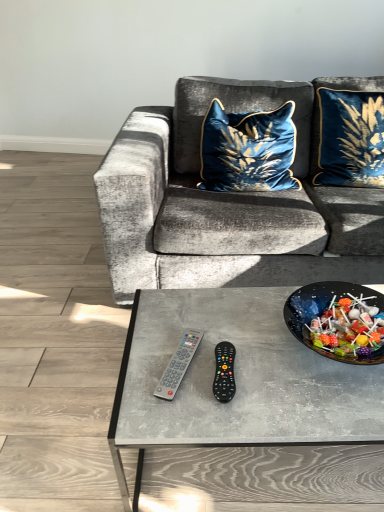
Question: Is velvet blue cushion at center, which is counted as the 1th pillow, starting from the left, smaller than gray plastic remote at center?

Choices:
 (A) yes
 (B) no

Answer: (B)

Question: Does velvet blue cushion at center, placed as the second pillow when sorted from right to left, appear on the right side of gray plastic remote at center?

Choices:
 (A) no
 (B) yes

Answer: (B)

Question: Does velvet blue cushion at center, which is counted as the 1th pillow, starting from the left, lie behind gray plastic remote at center?

Choices:
 (A) no
 (B) yes

Answer: (B)

Question: Does velvet blue cushion at center, which is counted as the 1th pillow, starting from the left, have a greater width compared to gray plastic remote at center?

Choices:
 (A) yes
 (B) no

Answer: (A)

Question: Can you confirm if velvet blue cushion at center, placed as the second pillow when sorted from right to left, is shorter than gray plastic remote at center?

Choices:
 (A) no
 (B) yes

Answer: (A)

Question: Is velvet blue cushion at center, placed as the second pillow when sorted from right to left, positioned beyond the bounds of gray plastic remote at center?

Choices:
 (A) yes
 (B) no

Answer: (A)

Question: Does black plastic remote at center have a greater height compared to velvet blue pillow at upper right, positioned as the second pillow in left-to-right order?

Choices:
 (A) no
 (B) yes

Answer: (A)

Question: Does black plastic remote at center contain velvet blue pillow at upper right, positioned as the second pillow in left-to-right order?

Choices:
 (A) no
 (B) yes

Answer: (A)

Question: Is black plastic remote at center at the left side of velvet blue pillow at upper right, marked as the 1th pillow in a right-to-left arrangement?

Choices:
 (A) yes
 (B) no

Answer: (A)

Question: Is black plastic remote at center to the right of velvet blue pillow at upper right, marked as the 1th pillow in a right-to-left arrangement, from the viewer's perspective?

Choices:
 (A) yes
 (B) no

Answer: (B)

Question: Is black plastic remote at center closer to the viewer compared to velvet blue pillow at upper right, marked as the 1th pillow in a right-to-left arrangement?

Choices:
 (A) no
 (B) yes

Answer: (B)

Question: Is black plastic remote at center beside velvet blue pillow at upper right, marked as the 1th pillow in a right-to-left arrangement?

Choices:
 (A) no
 (B) yes

Answer: (A)

Question: Can you confirm if black plastic remote at center is wider than gray plastic remote at center?

Choices:
 (A) yes
 (B) no

Answer: (B)